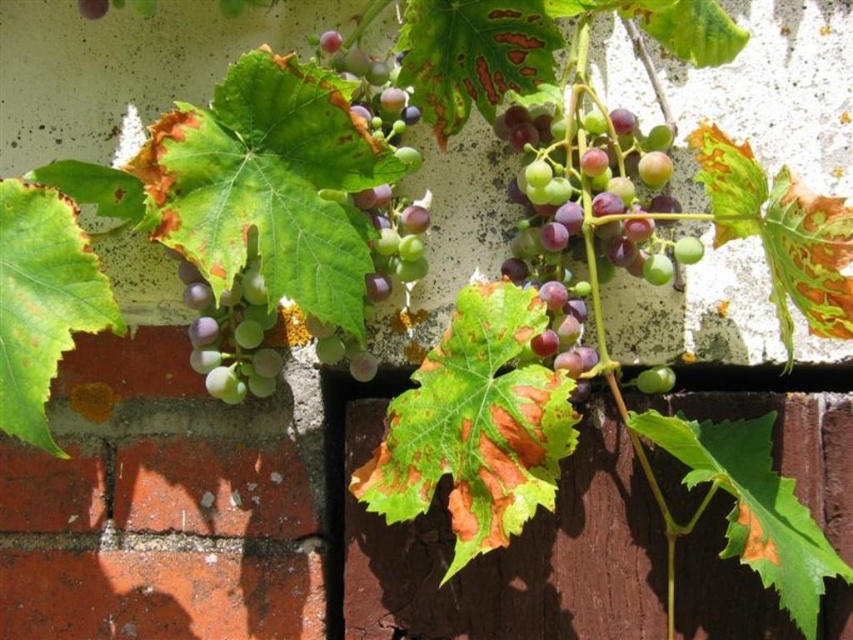
Question: Is purple matte grapes at center to the left of matte purple grapes at center-left from the viewer's perspective?

Choices:
 (A) yes
 (B) no

Answer: (B)

Question: Does purple matte grapes at center lie in front of green matte grapes at upper center?

Choices:
 (A) yes
 (B) no

Answer: (B)

Question: Is purple matte grapes at center above green matte grape at center?

Choices:
 (A) yes
 (B) no

Answer: (A)

Question: Which of these objects is positioned farthest from the green matte grapes at upper center?

Choices:
 (A) green matte grape at center
 (B) matte purple grapes at center-left

Answer: (A)

Question: Which point is closer to the camera taking this photo?

Choices:
 (A) (534, 182)
 (B) (653, 387)
 (C) (374, 266)
 (D) (244, 310)

Answer: (A)

Question: Estimate the real-world distances between objects in this image. Which object is closer to the green matte grapes at upper center?

Choices:
 (A) purple matte grapes at center
 (B) green matte grape at center

Answer: (A)